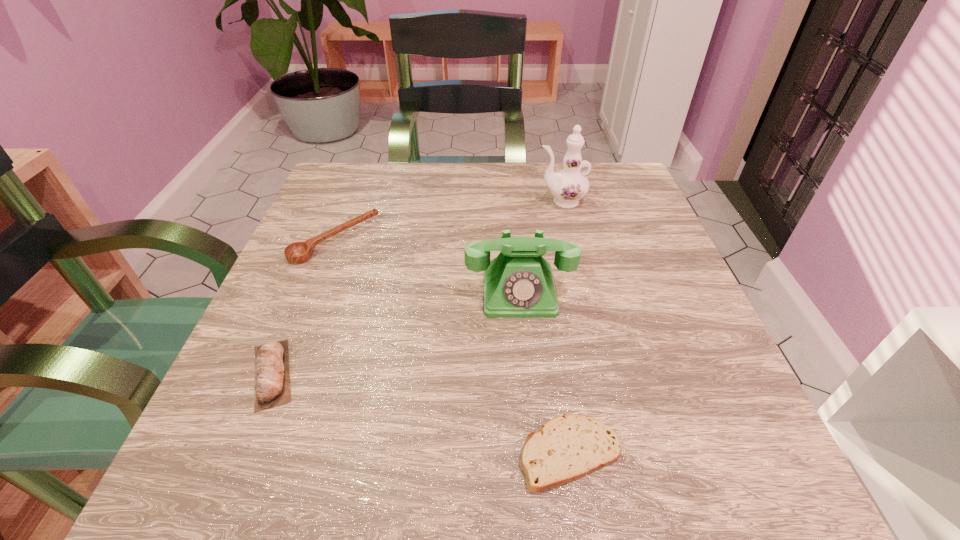
Identify the location of object located in the right edge section of the desktop. (568, 186).

Identify the location of object at the far right corner. (568, 186).

The image size is (960, 540). I want to click on vacant space at the far edge of the desktop, so click(x=551, y=200).

Locate an element on the screen. The width and height of the screenshot is (960, 540). free region at the left edge of the desktop is located at coordinates (275, 303).

At what (x,y) coordinates should I click in order to perform the action: click on vacant area at the right edge of the desktop. Please return your answer as a coordinate pair (x, y). This screenshot has height=540, width=960. Looking at the image, I should click on (720, 375).

This screenshot has width=960, height=540. In the image, there is a desktop. Find the location of `free space at the far left corner`. free space at the far left corner is located at coordinates (339, 194).

Where is `free space at the far right corner of the desktop`? Image resolution: width=960 pixels, height=540 pixels. free space at the far right corner of the desktop is located at coordinates (606, 192).

Where is `blank area at the near right corner`? This screenshot has width=960, height=540. blank area at the near right corner is located at coordinates (732, 437).

Identify the location of vacant area that lies between the nearest object and the third nearest object. This screenshot has height=540, width=960. (544, 373).

Identify the location of vacant area that lies between the second farthest object and the shortest object. (452, 347).